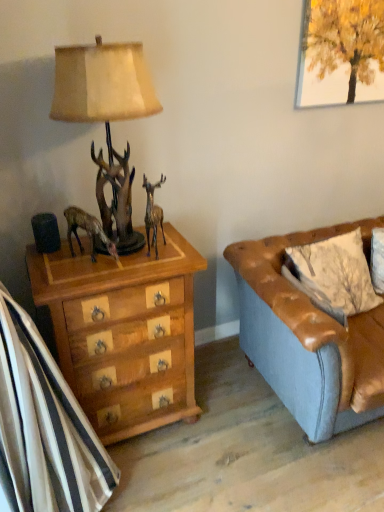
What are the coordinates of `free spot in front of metallic gold reindeer at center` in the screenshot? It's located at (143, 267).